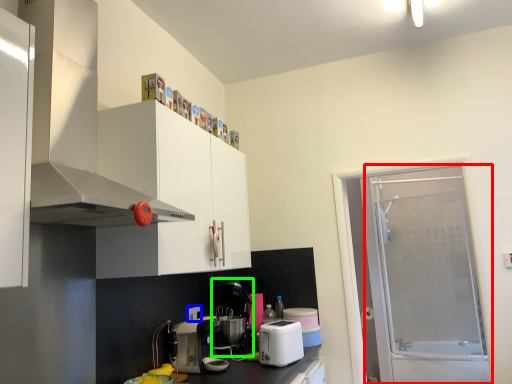
Question: Estimate the real-world distances between objects in this image. Which object is farther from screen door (highlighted by a red box), electric outlet (highlighted by a blue box) or coffee machine (highlighted by a green box)?

Choices:
 (A) electric outlet
 (B) coffee machine

Answer: (A)